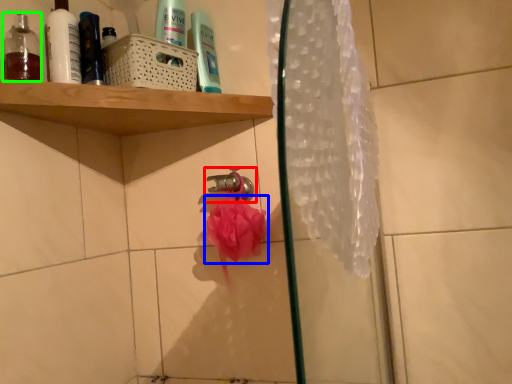
Question: Which is nearer to the tap (highlighted by a red box)? flower (highlighted by a blue box) or mouthwash (highlighted by a green box).

Choices:
 (A) flower
 (B) mouthwash

Answer: (A)